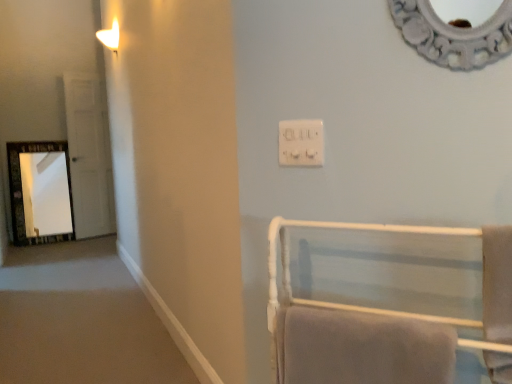
Question: Does matte white sconce at upper left have a greater width compared to white glossy door at left?

Choices:
 (A) yes
 (B) no

Answer: (A)

Question: Considering the relative positions of matte white sconce at upper left and white glossy door at left in the image provided, is matte white sconce at upper left in front of white glossy door at left?

Choices:
 (A) yes
 (B) no

Answer: (A)

Question: Can you confirm if matte white sconce at upper left is smaller than white glossy door at left?

Choices:
 (A) no
 (B) yes

Answer: (B)

Question: Is matte white sconce at upper left not near white glossy door at left?

Choices:
 (A) no
 (B) yes

Answer: (B)

Question: From the image's perspective, is matte white sconce at upper left below white glossy door at left?

Choices:
 (A) no
 (B) yes

Answer: (A)

Question: Is matte white sconce at upper left turned away from white glossy door at left?

Choices:
 (A) yes
 (B) no

Answer: (B)

Question: Is white glossy door at left further to camera compared to white soft towel at right, which is the first bath towel from right to left?

Choices:
 (A) no
 (B) yes

Answer: (B)

Question: From the image's perspective, does white glossy door at left appear higher than white soft towel at right, which is the first bath towel from right to left?

Choices:
 (A) no
 (B) yes

Answer: (B)

Question: Considering the relative sizes of white glossy door at left and white soft towel at right, which is the first bath towel from right to left, in the image provided, is white glossy door at left wider than white soft towel at right, which is the first bath towel from right to left,?

Choices:
 (A) yes
 (B) no

Answer: (B)

Question: Is white glossy door at left looking in the opposite direction of white soft towel at right, arranged as the second bath towel when viewed from the left?

Choices:
 (A) no
 (B) yes

Answer: (A)

Question: Does white glossy door at left have a larger size compared to white soft towel at right, arranged as the second bath towel when viewed from the left?

Choices:
 (A) yes
 (B) no

Answer: (A)

Question: Is white soft towel at right, which is the first bath towel from right to left, a part of white glossy door at left?

Choices:
 (A) no
 (B) yes

Answer: (A)

Question: Can you confirm if white glossy door at left is positioned to the left of white plastic electrical outlet at upper center?

Choices:
 (A) yes
 (B) no

Answer: (A)